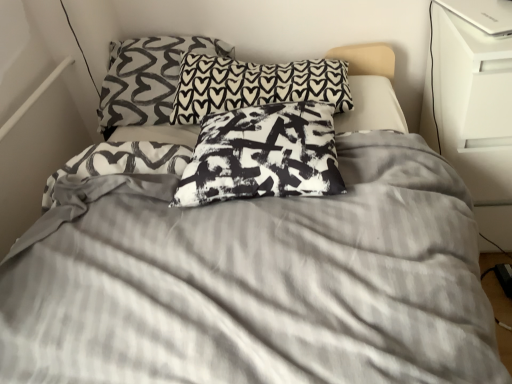
Question: Considering their positions, is black printed pillow at upper center, acting as the second pillow starting from the front, located in front of or behind black printed pillow at upper center, which appears as the 3th pillow when viewed from the front?

Choices:
 (A) front
 (B) behind

Answer: (A)

Question: Is point (212, 64) closer or farther from the camera than point (117, 44)?

Choices:
 (A) farther
 (B) closer

Answer: (B)

Question: Based on their relative distances, which object is farther from the black printed pillow at center, the first pillow in the front-to-back sequence?

Choices:
 (A) black printed pillow at upper center, which appears as the first pillow when viewed from the back
 (B) white glossy dresser at right
 (C) black printed pillow at upper center, acting as the second pillow starting from the front

Answer: (A)

Question: Which object is the closest to the black printed pillow at upper center, acting as the second pillow starting from the front?

Choices:
 (A) white glossy dresser at right
 (B) black printed pillow at upper center, which appears as the first pillow when viewed from the back
 (C) black printed pillow at center, the first pillow in the front-to-back sequence

Answer: (B)